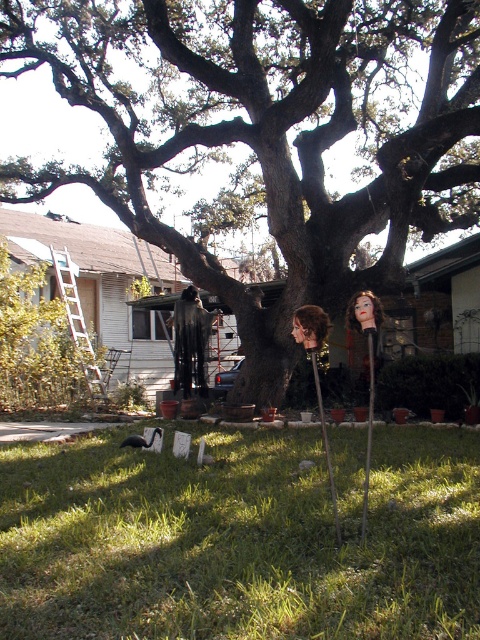
Question: Does green grass at lower center come behind metallic silver ladder at left?

Choices:
 (A) no
 (B) yes

Answer: (A)

Question: Can you confirm if green grass at lower center is bigger than metallic silver ladder at left?

Choices:
 (A) yes
 (B) no

Answer: (B)

Question: Which is farther from the green grass at lower center?

Choices:
 (A) metallic silver ladder at left
 (B) brown rough bark tree at center

Answer: (B)

Question: Where is brown rough bark tree at center located in relation to metallic silver ladder at left in the image?

Choices:
 (A) above
 (B) below

Answer: (A)

Question: Among these objects, which one is nearest to the camera?

Choices:
 (A) metallic silver ladder at left
 (B) brown rough bark tree at center
 (C) green grass at lower center

Answer: (C)

Question: Estimate the real-world distances between objects in this image. Which object is closer to the green grass at lower center?

Choices:
 (A) metallic silver ladder at left
 (B) brown rough bark tree at center

Answer: (A)